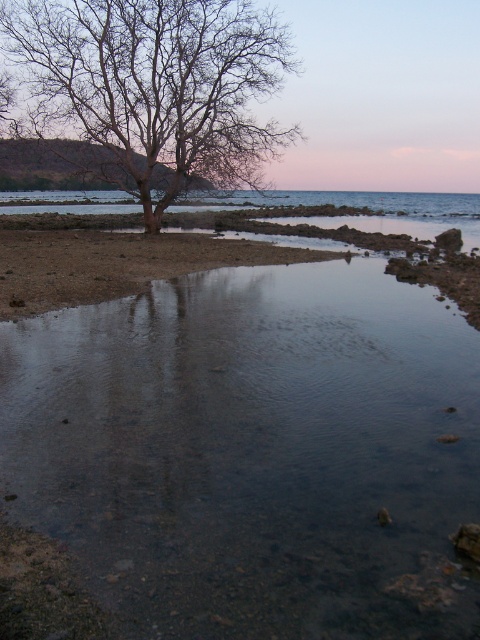
Question: Does clear water at center appear under bare wood tree at upper left?

Choices:
 (A) no
 (B) yes

Answer: (B)

Question: Which object is farther from the camera taking this photo?

Choices:
 (A) clear water at center
 (B) bare wood tree at upper left

Answer: (B)

Question: Which object appears closest to the camera in this image?

Choices:
 (A) bare wood tree at upper left
 (B) clear water at center

Answer: (B)

Question: Is clear water at center to the right of bare wood tree at upper left from the viewer's perspective?

Choices:
 (A) yes
 (B) no

Answer: (B)

Question: Can you confirm if clear water at center is smaller than bare wood tree at upper left?

Choices:
 (A) no
 (B) yes

Answer: (B)